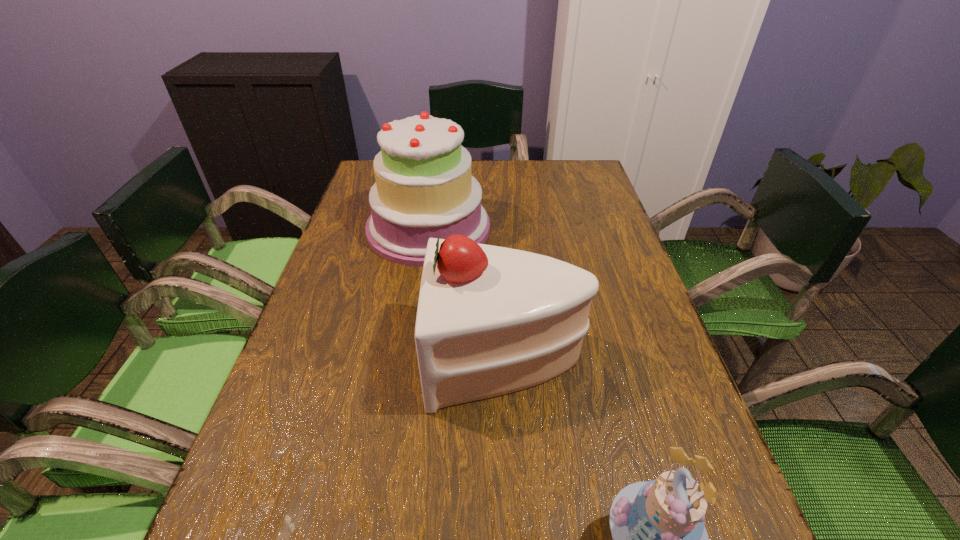
Locate which cake ranks in proximity to the farthest object. Please provide its 2D coordinates. Your answer should be formatted as a tuple, i.e. [(x, y)], where the tuple contains the x and y coordinates of a point satisfying the conditions above.

[(491, 320)]

Identify which cake is the closest to the second farthest object. Please provide its 2D coordinates. Your answer should be formatted as a tuple, i.e. [(x, y)], where the tuple contains the x and y coordinates of a point satisfying the conditions above.

[(424, 187)]

Identify the location of free location that satisfies the following two spatial constraints: 1. on the front side of the farthest cake; 2. on the right side of the second farthest object. (409, 359).